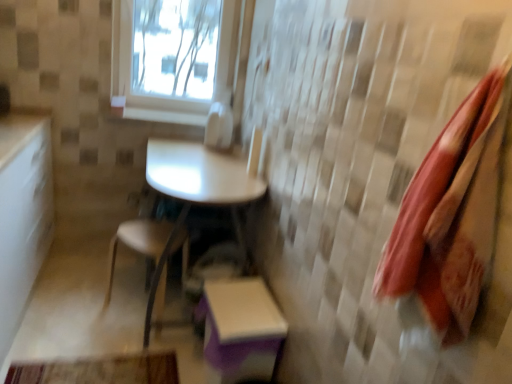
Identify the location of purple matte step stool at lower center. This screenshot has width=512, height=384. (240, 323).

This screenshot has height=384, width=512. What do you see at coordinates (151, 258) in the screenshot?
I see `metallic silver chair at center` at bounding box center [151, 258].

This screenshot has width=512, height=384. Find the location of `white glossy window sill at upper center`. white glossy window sill at upper center is located at coordinates (161, 110).

Image resolution: width=512 pixels, height=384 pixels. In order to click on transparent glass window at upper center in this screenshot , I will do `click(170, 58)`.

Considering their positions, is purple matte step stool at lower center located in front of or behind red fabric towel at right?

Clearly, purple matte step stool at lower center is behind red fabric towel at right.

Can you confirm if purple matte step stool at lower center is thinner than red fabric towel at right?

In fact, purple matte step stool at lower center might be wider than red fabric towel at right.

Is purple matte step stool at lower center touching red fabric towel at right?

There is a gap between purple matte step stool at lower center and red fabric towel at right.

Where is `beach towel that appears above the purple matte step stool at lower center (from a real-world perspective)`? This screenshot has height=384, width=512. beach towel that appears above the purple matte step stool at lower center (from a real-world perspective) is located at coordinates (448, 222).

Would you say metallic silver chair at center contains red fabric towel at right?

No.

From the image's perspective, would you say metallic silver chair at center is positioned over red fabric towel at right?

No, from the image's perspective, metallic silver chair at center is not over red fabric towel at right.

Is metallic silver chair at center shorter than red fabric towel at right?

Yes, metallic silver chair at center is shorter than red fabric towel at right.

Considering the sizes of transparent glass window at upper center and purple matte step stool at lower center in the image, is transparent glass window at upper center wider or thinner than purple matte step stool at lower center?

Clearly, transparent glass window at upper center has less width compared to purple matte step stool at lower center.

Measure the distance from transparent glass window at upper center to purple matte step stool at lower center.

transparent glass window at upper center and purple matte step stool at lower center are 4.49 feet apart.

Visually, is transparent glass window at upper center positioned to the left or to the right of purple matte step stool at lower center?

transparent glass window at upper center is positioned on purple matte step stool at lower center's left side.

Can you confirm if transparent glass window at upper center is smaller than purple matte step stool at lower center?

Actually, transparent glass window at upper center might be larger than purple matte step stool at lower center.

From the image's perspective, is transparent glass window at upper center located above or below red fabric towel at right?

Clearly, from the image's perspective, transparent glass window at upper center is above red fabric towel at right.

Does transparent glass window at upper center come in front of red fabric towel at right?

No, transparent glass window at upper center is behind red fabric towel at right.

Would you consider transparent glass window at upper center to be distant from red fabric towel at right?

Yes, transparent glass window at upper center and red fabric towel at right are quite far apart.

Locate an element on the screen. Image resolution: width=512 pixels, height=384 pixels. window lying on the left of red fabric towel at right is located at coordinates (170, 58).

Consider the image. Is white glossy table at center shorter than white glossy window sill at upper center?

Incorrect, the height of white glossy table at center does not fall short of that of white glossy window sill at upper center.

Is white glossy table at center bigger than white glossy window sill at upper center?

Yes.

In the image, is white glossy table at center positioned in front of or behind white glossy window sill at upper center?

white glossy table at center is positioned closer to the viewer than white glossy window sill at upper center.

Does white glossy table at center appear on the right side of white glossy window sill at upper center?

Indeed, white glossy table at center is positioned on the right side of white glossy window sill at upper center.

Which object is further away from the camera taking this photo, metallic silver chair at center or white glossy table at center?

metallic silver chair at center.

From a real-world perspective, is metallic silver chair at center located higher than white glossy table at center?

Incorrect, from a real-world perspective, metallic silver chair at center is lower than white glossy table at center.

Is metallic silver chair at center placed right next to white glossy table at center?

metallic silver chair at center is not next to white glossy table at center, and they're not touching.

Considering the relative sizes of white glossy window sill at upper center and metallic silver chair at center in the image provided, is white glossy window sill at upper center taller than metallic silver chair at center?

Incorrect, the height of white glossy window sill at upper center is not larger of that of metallic silver chair at center.

Considering the positions of objects white glossy window sill at upper center and metallic silver chair at center in the image provided, who is more to the left, white glossy window sill at upper center or metallic silver chair at center?

From the viewer's perspective, metallic silver chair at center appears more on the left side.

Considering the sizes of white glossy window sill at upper center and metallic silver chair at center in the image, is white glossy window sill at upper center bigger or smaller than metallic silver chair at center?

Clearly, white glossy window sill at upper center is smaller in size than metallic silver chair at center.

The width and height of the screenshot is (512, 384). Identify the location of chair in front of the white glossy window sill at upper center. (151, 258).

The width and height of the screenshot is (512, 384). I want to click on step stool located on the left of red fabric towel at right, so click(x=240, y=323).

Find the location of a particular element. The image size is (512, 384). chair below the red fabric towel at right (from a real-world perspective) is located at coordinates (151, 258).

Estimate the real-world distances between objects in this image. Which object is further from red fabric towel at right, metallic silver chair at center or white glossy window sill at upper center?

white glossy window sill at upper center lies further to red fabric towel at right than the other object.

From the image, which object appears to be nearer to white glossy table at center, white glossy window sill at upper center or red fabric towel at right?

white glossy window sill at upper center.

Considering their positions, is purple matte step stool at lower center positioned further to white glossy table at center than transparent glass window at upper center?

transparent glass window at upper center.

Considering their positions, is white glossy table at center positioned closer to transparent glass window at upper center than red fabric towel at right?

white glossy table at center.

Looking at the image, which one is located further to transparent glass window at upper center, white glossy window sill at upper center or metallic silver chair at center?

metallic silver chair at center.

Which object lies further to the anchor point red fabric towel at right, white glossy table at center or transparent glass window at upper center?

The object further to red fabric towel at right is transparent glass window at upper center.

Considering their positions, is transparent glass window at upper center positioned further to purple matte step stool at lower center than red fabric towel at right?

Based on the image, transparent glass window at upper center appears to be further to purple matte step stool at lower center.

Which object lies further to the anchor point red fabric towel at right, transparent glass window at upper center or white glossy table at center?

The object further to red fabric towel at right is transparent glass window at upper center.

This screenshot has width=512, height=384. I want to click on chair between red fabric towel at right and transparent glass window at upper center from front to back, so click(x=151, y=258).

Where is `step stool located between red fabric towel at right and white glossy window sill at upper center in the depth direction`? step stool located between red fabric towel at right and white glossy window sill at upper center in the depth direction is located at coordinates (240, 323).

Identify the location of table positioned between red fabric towel at right and transparent glass window at upper center from near to far. This screenshot has width=512, height=384. (199, 173).

In order to click on table located between metallic silver chair at center and purple matte step stool at lower center in the left-right direction in this screenshot , I will do `click(199, 173)`.